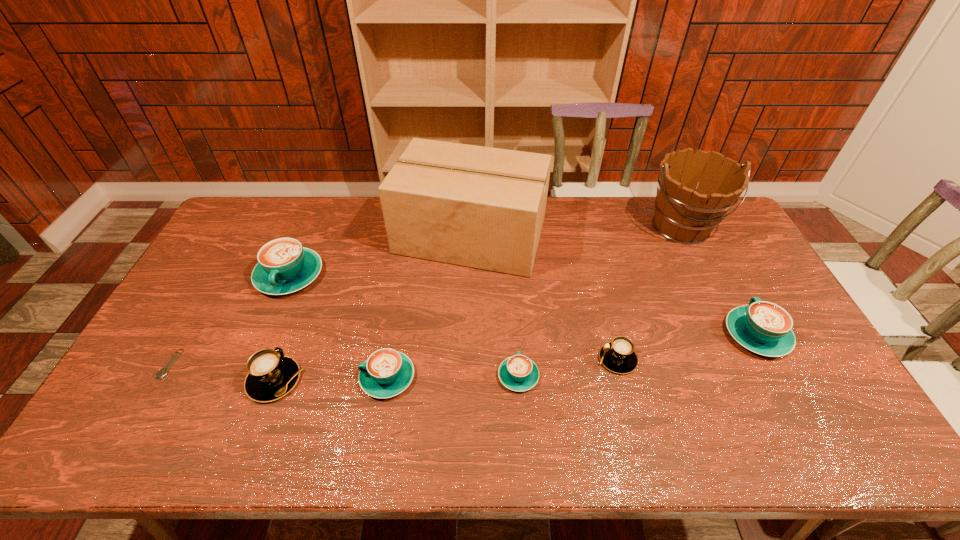
Find the location of a particular element. This screenshot has height=540, width=960. vacant space located with the handle on the right side of the second biggest turquoise cappuccino is located at coordinates tap(725, 275).

The image size is (960, 540). Identify the location of vacant space located on the right of the left black cappuccino. (386, 380).

In order to click on vacant point located with the handle on the right side of the third biggest turquoise cappuccino in this screenshot , I will do `click(334, 377)`.

At what (x,y) coordinates should I click in order to perform the action: click on free point located 0.150m with the handle on the right side of the third biggest turquoise cappuccino. Please return your answer as a coordinate pair (x, y). This screenshot has height=540, width=960. Looking at the image, I should click on (303, 377).

Locate an element on the screen. The image size is (960, 540). free space located with the handle on the right side of the third biggest turquoise cappuccino is located at coordinates [x=307, y=377].

Identify the location of vacant space positioned 0.080m on the front of the second cappuccino from right to left. The image size is (960, 540). (629, 403).

The height and width of the screenshot is (540, 960). I want to click on vacant region located with the handle on the right side of the eighth tallest object, so click(514, 313).

Locate an element on the screen. The height and width of the screenshot is (540, 960). vacant space situated 0.310m with the handle on the right side of the eighth tallest object is located at coordinates (512, 277).

Locate an element on the screen. This screenshot has height=540, width=960. vacant space located with the handle on the right side of the eighth tallest object is located at coordinates (516, 329).

Locate an element on the screen. The height and width of the screenshot is (540, 960). free location located 0.160m on the right of the leftmost object is located at coordinates (236, 364).